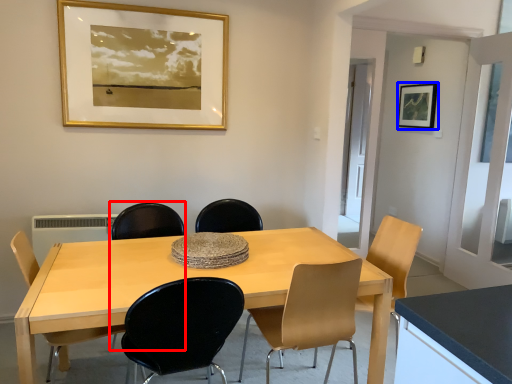
Question: Which object is further to the camera taking this photo, armchair (highlighted by a red box) or picture frame (highlighted by a blue box)?

Choices:
 (A) armchair
 (B) picture frame

Answer: (B)